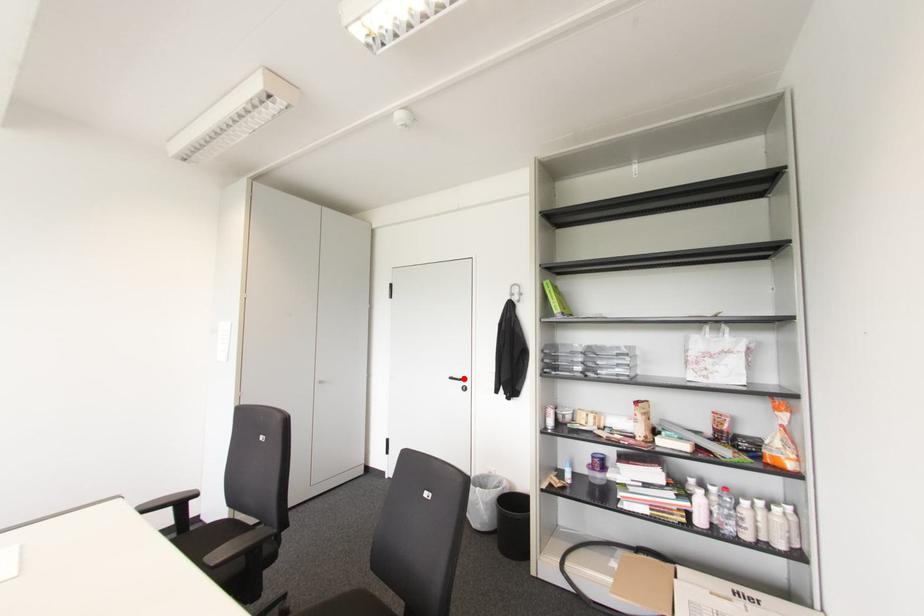
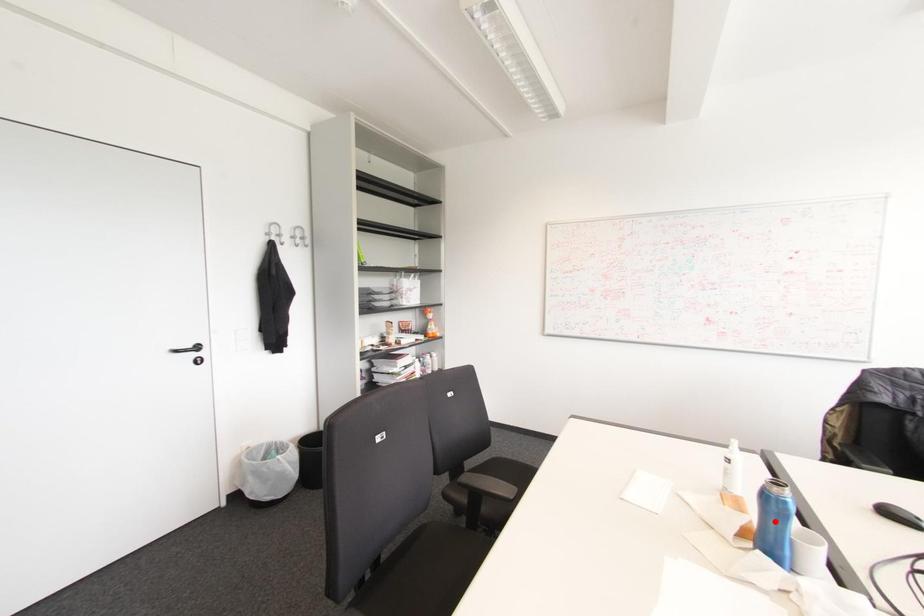
I am providing you with two images of the same scene from different viewpoints. A red point is marked on the first image and another point is marked on the second image. Do the highlighted points in image1 and image2 indicate the same real-world spot?

No